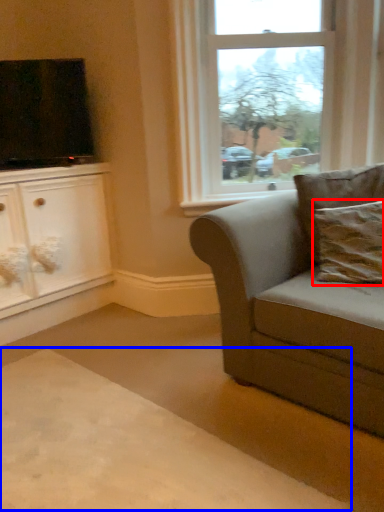
Question: Which object appears farthest to the camera in this image, pillow (highlighted by a red box) or plain (highlighted by a blue box)?

Choices:
 (A) pillow
 (B) plain

Answer: (A)